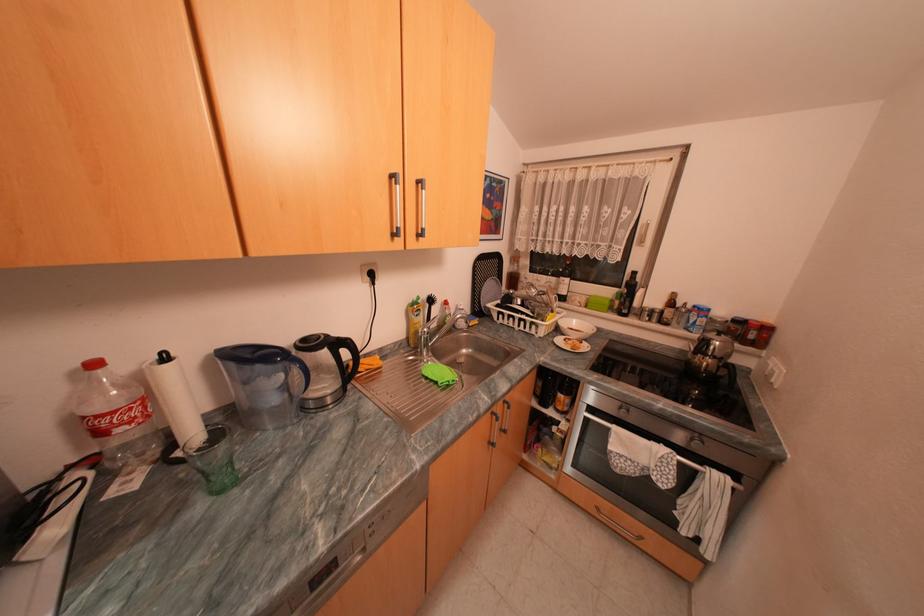
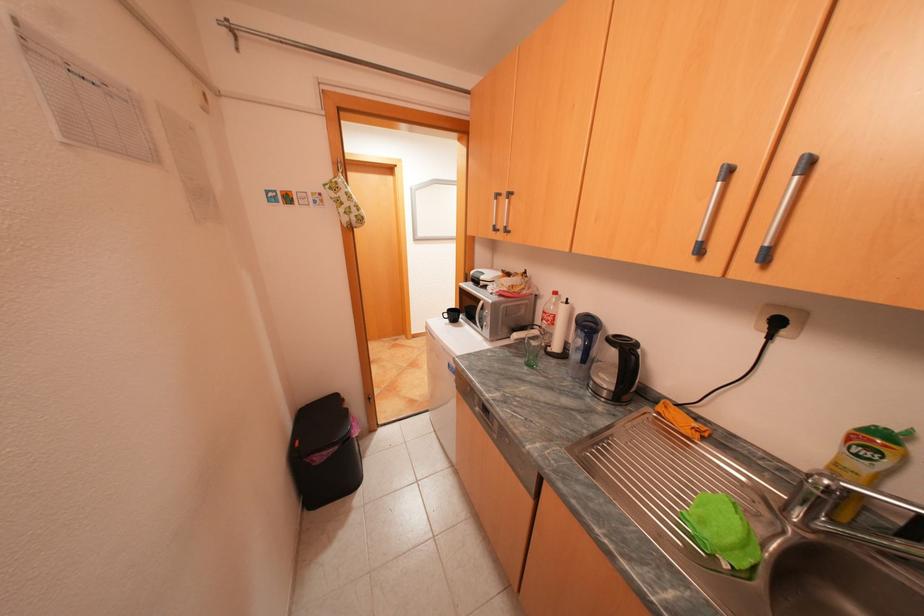
Locate, in the second image, the point that corresponds to point 210,506 in the first image.

(530, 360)